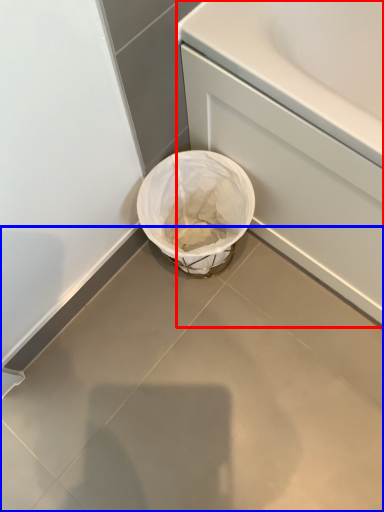
Question: Which object is closer to the camera taking this photo, bath (highlighted by a red box) or concrete (highlighted by a blue box)?

Choices:
 (A) bath
 (B) concrete

Answer: (A)